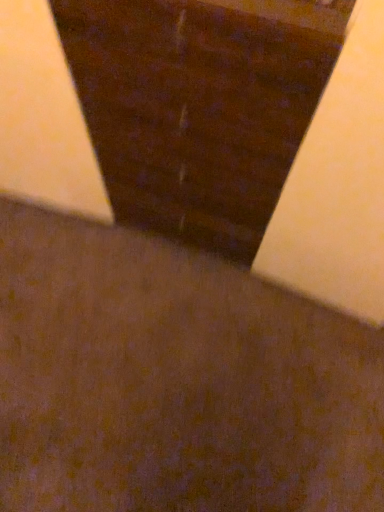
The width and height of the screenshot is (384, 512). What do you see at coordinates (174, 381) in the screenshot?
I see `brown matte concrete at center` at bounding box center [174, 381].

In order to click on brown matte concrete at center in this screenshot , I will do `click(174, 381)`.

Where is `brown matte concrete at center`? brown matte concrete at center is located at coordinates (174, 381).